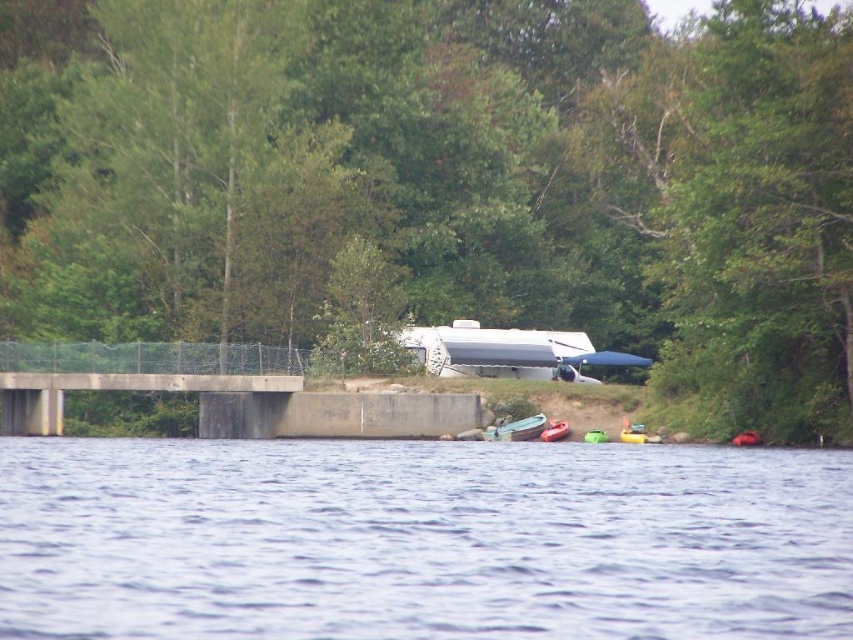
You are standing on the lakeside and see the transparent water at center and the metallic blue kayak at lower center. Which object is higher in the scene?

The transparent water at center is taller than the metallic blue kayak at lower center.

You are standing on the grassy shoreline to the right of the bridge and want to cross to the other side of the lake. Can you walk directly to the point at coordinates (421, 540) to reach the other side?

The point at coordinates (421, 540) is on transparent water at center, so walking there would not be possible since it is water and not land.